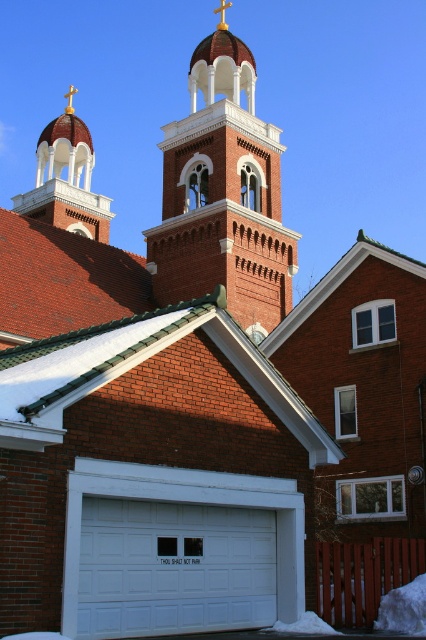
Is brick bell tower at center taller than white painted wood garage door at center?

Correct, brick bell tower at center is much taller as white painted wood garage door at center.

The image size is (426, 640). I want to click on brick bell tower at center, so click(x=222, y=195).

Image resolution: width=426 pixels, height=640 pixels. I want to click on brick bell tower at center, so click(222, 195).

Is point (216, 51) positioned behind point (46, 140)?

No, (216, 51) is closer to viewer.

Which is more to the right, brick bell tower at center or gold cross at upper center?

brick bell tower at center is more to the right.

Measure the distance between brick bell tower at center and camera.

They are 181.56 feet apart.

I want to click on brick bell tower at center, so click(222, 195).

Is white painted wood garage door at center thinner than gold cross at upper center?

Indeed, white painted wood garage door at center has a lesser width compared to gold cross at upper center.

Is white painted wood garage door at center in front of gold cross at upper center?

Yes, white painted wood garage door at center is in front of gold cross at upper center.

I want to click on white painted wood garage door at center, so click(173, 568).

The width and height of the screenshot is (426, 640). I want to click on white painted wood garage door at center, so click(173, 568).